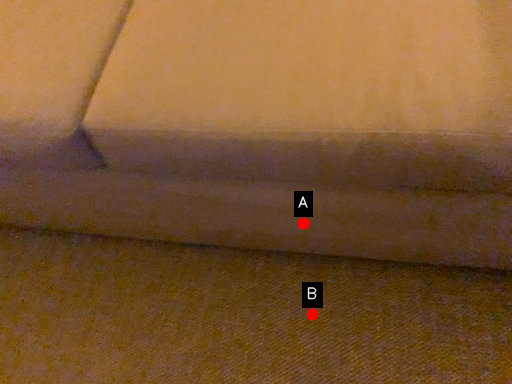
Question: Two points are circled on the image, labeled by A and B beside each circle. Which point is closer to the camera?

Choices:
 (A) A is closer
 (B) B is closer

Answer: (A)